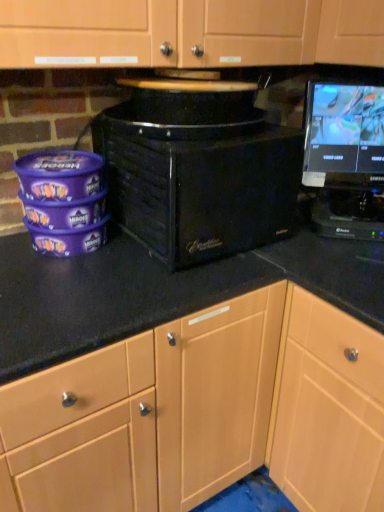
Question: Should I look upward or downward to see light wood cabinet at lower right?

Choices:
 (A) up
 (B) down

Answer: (B)

Question: Is light wood cabinet at lower right far away from black glossy monitor at upper right?

Choices:
 (A) yes
 (B) no

Answer: (B)

Question: Can you confirm if light wood cabinet at lower right is shorter than black glossy monitor at upper right?

Choices:
 (A) yes
 (B) no

Answer: (B)

Question: Does light wood cabinet at lower right have a smaller size compared to black glossy monitor at upper right?

Choices:
 (A) no
 (B) yes

Answer: (A)

Question: Considering the relative sizes of light wood cabinet at lower right and black glossy monitor at upper right in the image provided, is light wood cabinet at lower right wider than black glossy monitor at upper right?

Choices:
 (A) yes
 (B) no

Answer: (A)

Question: Does light wood cabinet at lower right appear on the right side of black glossy monitor at upper right?

Choices:
 (A) yes
 (B) no

Answer: (A)

Question: Can you confirm if light wood cabinet at lower right is taller than black glossy monitor at upper right?

Choices:
 (A) no
 (B) yes

Answer: (B)

Question: Can you confirm if black glossy monitor at upper right is bigger than light wood cabinet at lower right?

Choices:
 (A) yes
 (B) no

Answer: (B)

Question: Can we say black glossy monitor at upper right lies outside light wood cabinet at lower right?

Choices:
 (A) no
 (B) yes

Answer: (B)

Question: Is black glossy monitor at upper right at the left side of light wood cabinet at lower right?

Choices:
 (A) yes
 (B) no

Answer: (A)

Question: Considering the relative sizes of black glossy monitor at upper right and light wood cabinet at lower right in the image provided, is black glossy monitor at upper right thinner than light wood cabinet at lower right?

Choices:
 (A) no
 (B) yes

Answer: (B)

Question: Is black glossy monitor at upper right looking in the opposite direction of light wood cabinet at lower right?

Choices:
 (A) yes
 (B) no

Answer: (B)

Question: Is black glossy monitor at upper right next to light wood cabinet at lower right and touching it?

Choices:
 (A) no
 (B) yes

Answer: (A)

Question: Can you confirm if black matte microwave at center is positioned to the left of light wood cabinet at lower right?

Choices:
 (A) yes
 (B) no

Answer: (A)